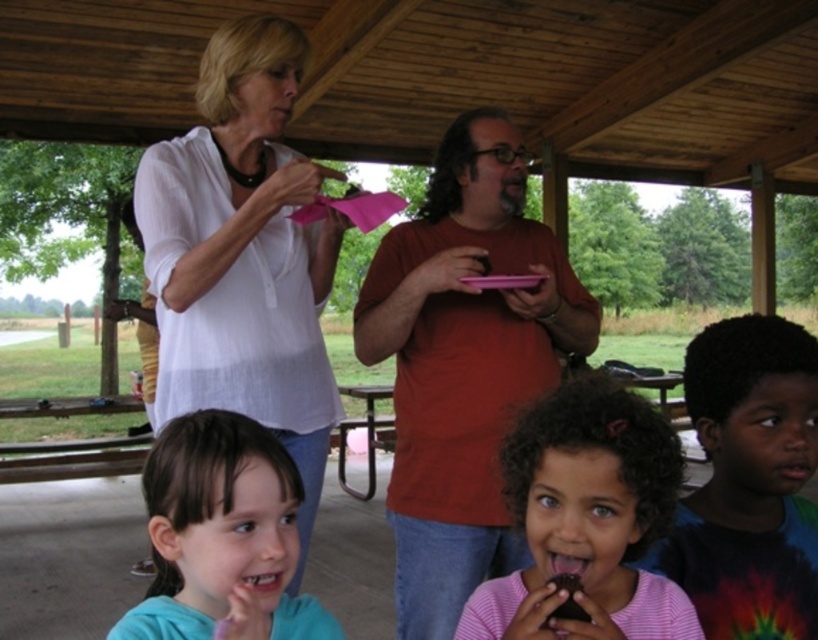
In the scene shown: You are organizing a group photo and need to arrange two adults wearing the matte red shirt at center and the white matte shirt at upper left in a row. If you want to place them side by side with equal spacing between them and the edges, which shirt should be placed closer to the center of the row?

The matte red shirt at center should be placed closer to the center of the row because it might be wider than the white matte shirt at upper left, so positioning it centrally would help balance the spacing.